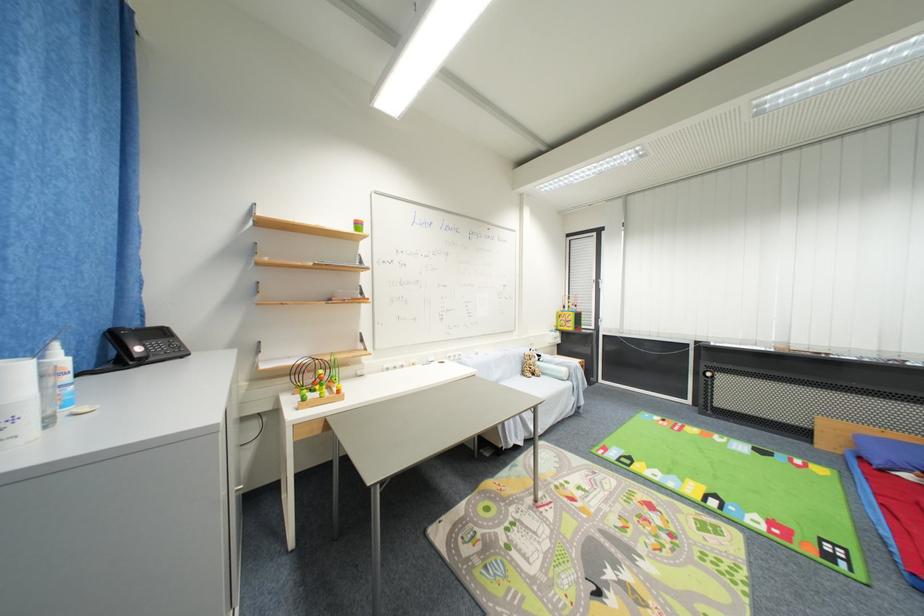
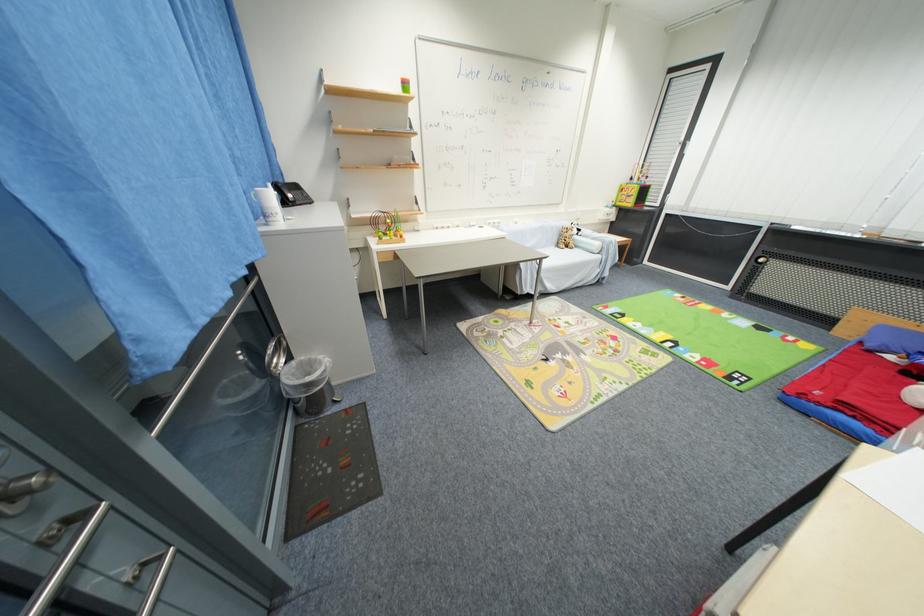
The point at (331, 424) is marked in the first image. Where is the corresponding point in the second image?

(399, 254)